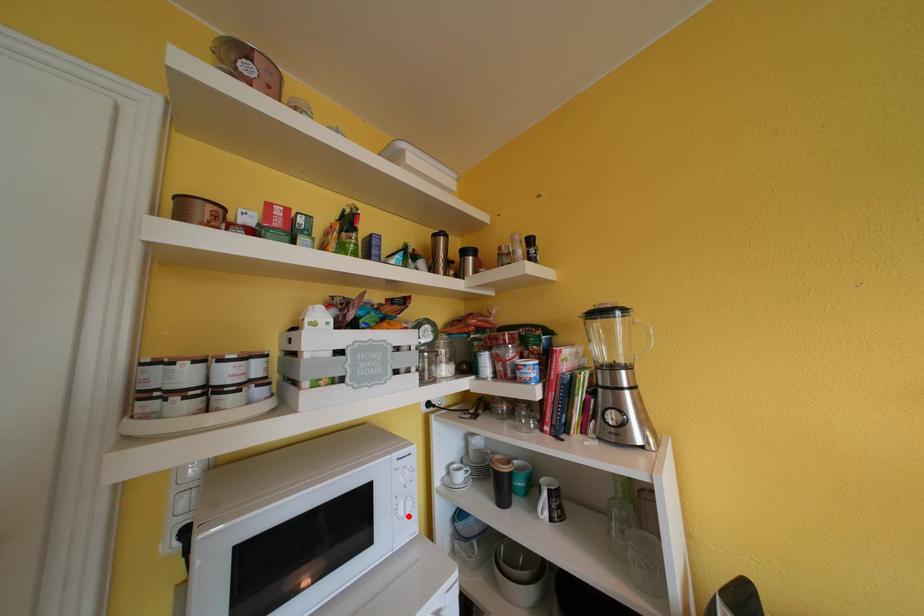
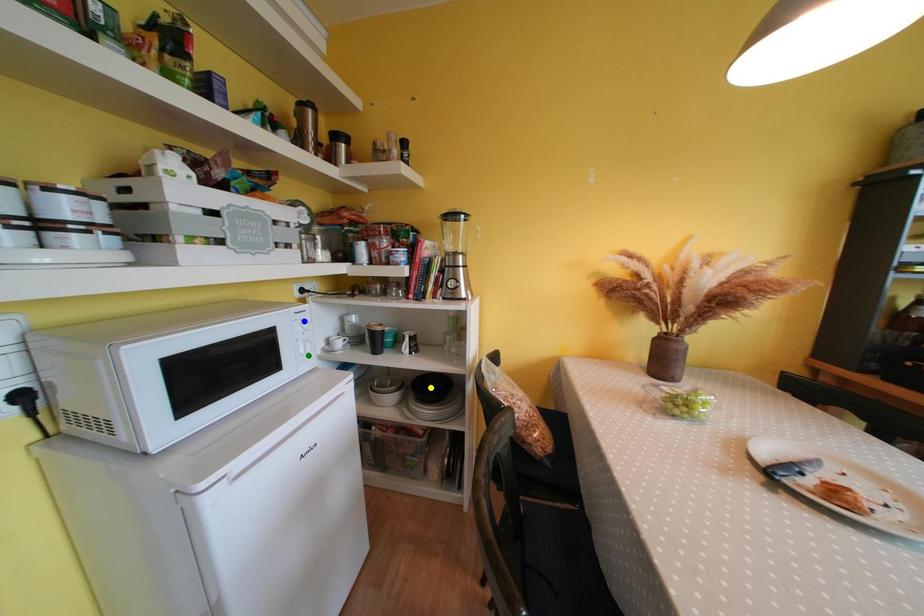
Question: I am providing you with two images of the same scene from different viewpoints. A red point is marked on the first image. You are given multiple points on the second image. Which mark in image 2 goes with the point in image 1?

Choices:
 (A) green point
 (B) yellow point
 (C) blue point

Answer: (A)